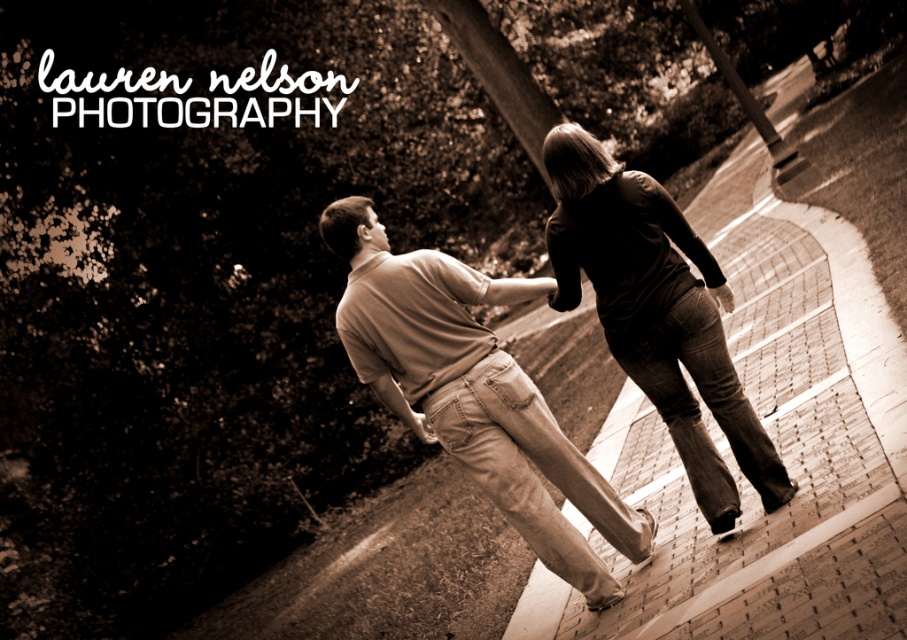
You are a fashion designer analyzing the clothing items in the image. Which clothing item, the matte brown shirt at center or the dark brown leather pants at center, has a bigger size?

The matte brown shirt at center has a larger size compared to the dark brown leather pants at center.

You are standing at the viewpoint of the photograph and want to place a small bench at the point labeled as point (847, 456). If the bench requires a space of 15 feet from the viewer to be placed safely, will the point be suitable?

The distance of point (847, 456) from viewer is 16.69 feet, which exceeds the required 15 feet, so the bench can be placed safely at that point.

You are a photographer analyzing the image. You need to determine which object occupies more vertical space in the composition. Based on the scene, which is taller between the brick pavement at center and the dark brown leather pants at center?

The brick pavement at center is much taller than the dark brown leather pants at center, so the brick pavement at center occupies more vertical space in the composition.